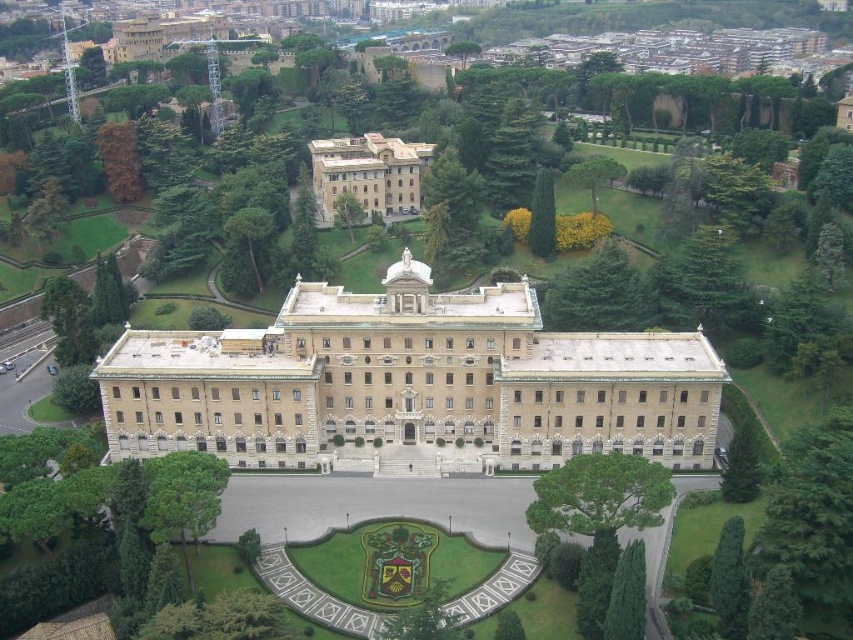
You are an architect planning to add a new wing to the beige stone palace at center and the beige stone building at upper center. Which structure should you choose to ensure the new addition maintains the symmetry of the grand building?

You should choose the beige stone building at upper center because it is smaller in size than the beige stone palace at center, allowing the new wing to better maintain the symmetry of the grand building.

You are standing in front of the beige stone palace at center and the beige stone building at upper center. Which one is closer to you?

The beige stone palace at center is closer to you because it is in front of the beige stone building at upper center.